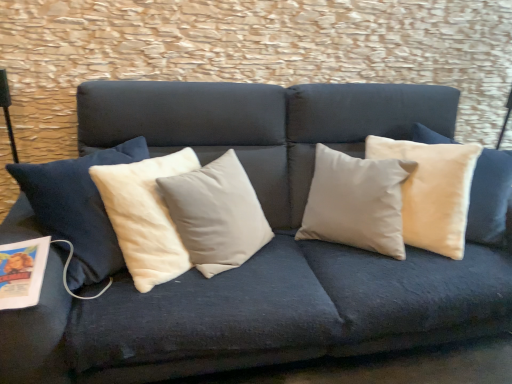
Identify the location of free space above matte paper magazine at lower left (from a real-world perspective). (14, 259).